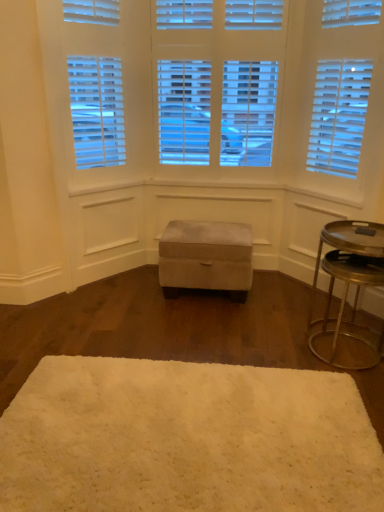
What do you see at coordinates (206, 258) in the screenshot? I see `suede ottoman at center` at bounding box center [206, 258].

What is the approximate width of metallic gold tray at right?

metallic gold tray at right is 20.96 inches wide.

At what (x,y) coordinates should I click in order to perform the action: click on suede ottoman at center. Please return your answer as a coordinate pair (x, y). Looking at the image, I should click on (206, 258).

Is point (223, 273) closer or farther from the camera than point (63, 453)?

Point (223, 273) is positioned farther from the camera compared to point (63, 453).

Can you confirm if suede ottoman at center is positioned to the right of white fluffy rug at center?

Correct, you'll find suede ottoman at center to the right of white fluffy rug at center.

Does suede ottoman at center have a larger size compared to white fluffy rug at center?

Yes.

Is suede ottoman at center thinner than white fluffy rug at center?

Yes, suede ottoman at center is thinner than white fluffy rug at center.

Considering the sizes of metallic gold tray at right and suede ottoman at center in the image, is metallic gold tray at right taller or shorter than suede ottoman at center?

Considering their sizes, metallic gold tray at right has more height than suede ottoman at center.

Is metallic gold tray at right positioned beyond the bounds of suede ottoman at center?

Yes, metallic gold tray at right is outside of suede ottoman at center.

Is metallic gold tray at right in front of or behind suede ottoman at center in the image?

metallic gold tray at right is positioned closer to the viewer than suede ottoman at center.

Is metallic gold tray at right positioned far away from suede ottoman at center?

Actually, metallic gold tray at right and suede ottoman at center are a little close together.

Is suede ottoman at center at the left side of metallic gold tray at right?

Indeed, suede ottoman at center is positioned on the left side of metallic gold tray at right.

From the image's perspective, does suede ottoman at center appear higher than metallic gold tray at right?

Correct, suede ottoman at center appears higher than metallic gold tray at right in the image.

In the image, is suede ottoman at center positioned in front of or behind metallic gold tray at right?

Clearly, suede ottoman at center is behind metallic gold tray at right.

What's the angular difference between suede ottoman at center and metallic gold tray at right's facing directions?

The facing directions of suede ottoman at center and metallic gold tray at right are 90 degrees apart.

From the image's perspective, which one is positioned lower, white fluffy rug at center or suede ottoman at center?

From the image's view, white fluffy rug at center is below.

Considering the relative sizes of white fluffy rug at center and suede ottoman at center in the image provided, is white fluffy rug at center taller than suede ottoman at center?

In fact, white fluffy rug at center may be shorter than suede ottoman at center.

Is white fluffy rug at center completely or partially outside of suede ottoman at center?

Yes.

Does metallic gold tray at right have a larger size compared to white fluffy rug at center?

Yes, metallic gold tray at right is bigger than white fluffy rug at center.

From a real-world perspective, which object stands above the other?

metallic gold tray at right is physically above.

From the image's perspective, would you say metallic gold tray at right is shown under white fluffy rug at center?

No, from the image's perspective, metallic gold tray at right is not beneath white fluffy rug at center.

From the picture: Which object is positioned more to the left, metallic gold tray at right or white fluffy rug at center?

Positioned to the left is white fluffy rug at center.

Between white fluffy rug at center and metallic gold tray at right, which one has larger size?

With larger size is metallic gold tray at right.

From their relative heights in the image, would you say white fluffy rug at center is taller or shorter than metallic gold tray at right?

In the image, white fluffy rug at center appears to be shorter than metallic gold tray at right.

Considering the points (372, 469) and (382, 345), which point is in front, point (372, 469) or point (382, 345)?

The point (372, 469) is closer.

You are a GUI agent. You are given a task and a screenshot of the screen. Output one action in this format:
    pyautogui.click(x=<x>, y=<y>)
    Task: Click on the music stool to the right of white fluffy rug at center
    This screenshot has width=384, height=512.
    Given the screenshot: What is the action you would take?
    pyautogui.click(x=206, y=258)

At what (x,y) coordinates should I click in order to perform the action: click on music stool below the metallic gold tray at right (from a real-world perspective). Please return your answer as a coordinate pair (x, y). The height and width of the screenshot is (512, 384). Looking at the image, I should click on (206, 258).

Considering their positions, is metallic gold tray at right positioned closer to white fluffy rug at center than suede ottoman at center?

metallic gold tray at right is positioned closer to the anchor white fluffy rug at center.

Which object lies nearer to the anchor point suede ottoman at center, metallic gold tray at right or white fluffy rug at center?

metallic gold tray at right is positioned closer to the anchor suede ottoman at center.

Looking at the image, which one is located further to metallic gold tray at right, suede ottoman at center or white fluffy rug at center?

white fluffy rug at center is further to metallic gold tray at right.

Based on their spatial positions, is white fluffy rug at center or suede ottoman at center further from metallic gold tray at right?

white fluffy rug at center is positioned further to the anchor metallic gold tray at right.

Considering their positions, is white fluffy rug at center positioned closer to suede ottoman at center than metallic gold tray at right?

Among the two, metallic gold tray at right is located nearer to suede ottoman at center.

Which object lies nearer to the anchor point white fluffy rug at center, suede ottoman at center or metallic gold tray at right?

The object closer to white fluffy rug at center is metallic gold tray at right.

The height and width of the screenshot is (512, 384). In order to click on table between white fluffy rug at center and suede ottoman at center from front to back in this screenshot , I will do `click(348, 283)`.